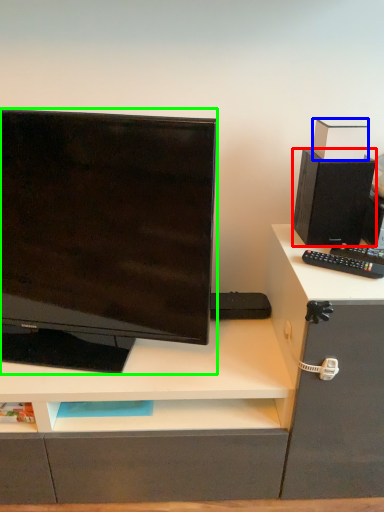
Question: Which is farther away from speaker (highlighted by a red box)? box (highlighted by a blue box) or computer monitor (highlighted by a green box)?

Choices:
 (A) box
 (B) computer monitor

Answer: (B)